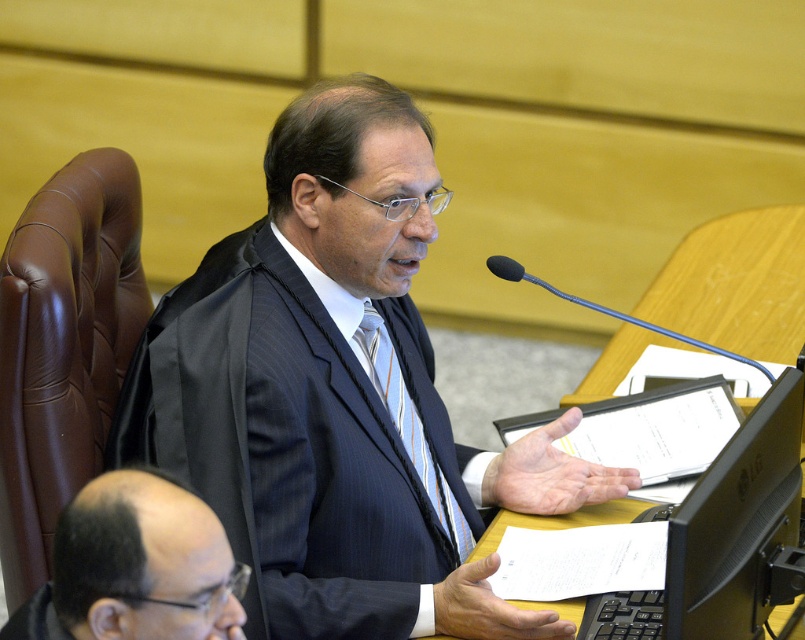
Question: Estimate the real-world distances between objects in this image. Which object is farther from the bald head at lower left?

Choices:
 (A) black plastic microphone at upper center
 (B) black plastic monitor at center
 (C) blue striped tie at center

Answer: (A)

Question: Which point is closer to the camera taking this photo?

Choices:
 (A) (134, 627)
 (B) (684, 573)
 (C) (745, 364)

Answer: (A)

Question: Can you confirm if dark blue pinstripe suit at center is positioned to the left of black plastic monitor at center?

Choices:
 (A) no
 (B) yes

Answer: (B)

Question: Does black plastic monitor at center have a greater width compared to blue striped tie at center?

Choices:
 (A) yes
 (B) no

Answer: (A)

Question: Is blue striped tie at center to the left of black plastic microphone at upper center from the viewer's perspective?

Choices:
 (A) yes
 (B) no

Answer: (A)

Question: Which object is the farthest from the black plastic microphone at upper center?

Choices:
 (A) blue striped tie at center
 (B) dark blue pinstripe suit at center

Answer: (B)